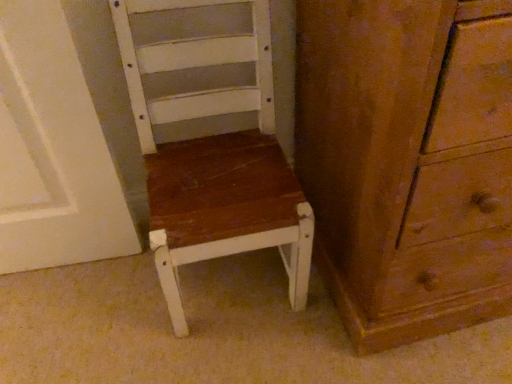
Where is `vacant area that is in front of white wood chair at center`? The width and height of the screenshot is (512, 384). vacant area that is in front of white wood chair at center is located at coordinates (229, 352).